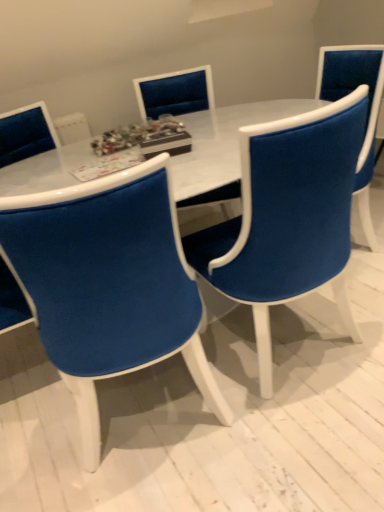
Describe the element at coordinates (108, 284) in the screenshot. I see `velvet blue chair at center, arranged as the first chair when viewed from the front` at that location.

At what (x,y) coordinates should I click in order to perform the action: click on velvet blue chair at center, the 1th chair in the back-to-front sequence. Please return your answer as a coordinate pair (x, y). Looking at the image, I should click on (175, 93).

Is velvet blue chair at center, arranged as the first chair when viewed from the front, at the right side of velvet blue chair at center, the 1th chair in the back-to-front sequence?

In fact, velvet blue chair at center, arranged as the first chair when viewed from the front, is to the left of velvet blue chair at center, the 1th chair in the back-to-front sequence.

Is velvet blue chair at center, the third chair positioned from the back, positioned beyond the bounds of velvet blue chair at center, the 1th chair in the back-to-front sequence?

Yes, velvet blue chair at center, the third chair positioned from the back, is outside of velvet blue chair at center, the 1th chair in the back-to-front sequence.

From the image's perspective, between velvet blue chair at center, arranged as the first chair when viewed from the front, and velvet blue chair at center, arranged as the third chair when viewed from the front, who is located below?

velvet blue chair at center, arranged as the first chair when viewed from the front, appears lower in the image.

How many degrees apart are the facing directions of velvet blue chair at center, the third chair positioned from the back, and velvet blue chair at center, the 1th chair in the back-to-front sequence?

There is a 165-degree angle between the facing directions of velvet blue chair at center, the third chair positioned from the back, and velvet blue chair at center, the 1th chair in the back-to-front sequence.

Considering the sizes of objects velvet blue chair at center, the third chair positioned from the back, and velvet blue chair at center, the 2th chair positioned from the front, in the image provided, who is wider, velvet blue chair at center, the third chair positioned from the back, or velvet blue chair at center, the 2th chair positioned from the front,?

velvet blue chair at center, the 2th chair positioned from the front, is wider.

Is velvet blue chair at center, the 2th chair positioned from the front, at the back of velvet blue chair at center, arranged as the first chair when viewed from the front?

No.

From a real-world perspective, between velvet blue chair at center, the third chair positioned from the back, and velvet blue chair at center, placed as the 2th chair when sorted from back to front, who is vertically higher?

velvet blue chair at center, the third chair positioned from the back, from a real-world perspective.

Does velvet blue chair at center, arranged as the first chair when viewed from the front, have a lesser height compared to velvet blue chair at center, placed as the 2th chair when sorted from back to front?

Correct, velvet blue chair at center, arranged as the first chair when viewed from the front, is not as tall as velvet blue chair at center, placed as the 2th chair when sorted from back to front.

From their relative heights in the image, would you say velvet blue chair at center, arranged as the third chair when viewed from the front, is taller or shorter than white marble table at center?

Clearly, velvet blue chair at center, arranged as the third chair when viewed from the front, is taller compared to white marble table at center.

In the image, is velvet blue chair at center, the 1th chair in the back-to-front sequence, positioned in front of or behind white marble table at center?

Clearly, velvet blue chair at center, the 1th chair in the back-to-front sequence, is behind white marble table at center.

Considering the points (193, 96) and (196, 126), which point is behind, point (193, 96) or point (196, 126)?

Positioned behind is point (193, 96).

Based on the photo, are velvet blue chair at center, the 1th chair in the back-to-front sequence, and white marble table at center beside each other?

No, velvet blue chair at center, the 1th chair in the back-to-front sequence, is not next to white marble table at center.

Which of these two, velvet blue chair at center, the third chair positioned from the back, or white marble table at center, is thinner?

velvet blue chair at center, the third chair positioned from the back, is thinner.

Between velvet blue chair at center, arranged as the first chair when viewed from the front, and white marble table at center, which one appears on the right side from the viewer's perspective?

white marble table at center is more to the right.

Is velvet blue chair at center, arranged as the first chair when viewed from the front, facing away from white marble table at center?

Yes, velvet blue chair at center, arranged as the first chair when viewed from the front,'s orientation is away from white marble table at center.

Locate an element on the screen. The image size is (384, 512). table on the right of velvet blue chair at center, arranged as the first chair when viewed from the front is located at coordinates (224, 143).

Does velvet blue chair at center, the 2th chair positioned from the front, come behind velvet blue chair at center, arranged as the first chair when viewed from the front?

Yes.

Is velvet blue chair at center, the 2th chair positioned from the front, facing towards velvet blue chair at center, the third chair positioned from the back?

No.

Is velvet blue chair at center, the 2th chair positioned from the front, inside or outside of velvet blue chair at center, arranged as the first chair when viewed from the front?

velvet blue chair at center, the 2th chair positioned from the front, lies outside velvet blue chair at center, arranged as the first chair when viewed from the front.

In the scene shown: Can you confirm if velvet blue chair at center, placed as the 2th chair when sorted from back to front, is wider than velvet blue chair at center, the third chair positioned from the back?

Yes.

Is point (38, 170) positioned after point (211, 95)?

That is False.

Is white marble table at center thinner than velvet blue chair at center, the 1th chair in the back-to-front sequence?

In fact, white marble table at center might be wider than velvet blue chair at center, the 1th chair in the back-to-front sequence.

Looking at this image, does white marble table at center turn towards velvet blue chair at center, arranged as the third chair when viewed from the front?

Yes, white marble table at center is aimed at velvet blue chair at center, arranged as the third chair when viewed from the front.

In terms of height, does white marble table at center look taller or shorter compared to velvet blue chair at center, arranged as the third chair when viewed from the front?

Clearly, white marble table at center is shorter compared to velvet blue chair at center, arranged as the third chair when viewed from the front.

Is white marble table at center situated inside velvet blue chair at center, the third chair positioned from the back, or outside?

white marble table at center is outside velvet blue chair at center, the third chair positioned from the back.

From a real-world perspective, which object stands above the other?

From a 3D spatial view, velvet blue chair at center, arranged as the first chair when viewed from the front, is above.

Is point (194, 195) positioned behind point (152, 358)?

Yes, point (194, 195) is farther from viewer.

From the image's perspective, is white marble table at center beneath velvet blue chair at center, the third chair positioned from the back?

Actually, white marble table at center appears above velvet blue chair at center, the third chair positioned from the back, in the image.

Locate an element on the screen. the 2nd chair below the velvet blue chair at center, arranged as the third chair when viewed from the front (from the image's perspective) is located at coordinates (108, 284).

Identify the location of the 1st chair above the velvet blue chair at center, the third chair positioned from the back (from the image's perspective). This screenshot has height=512, width=384. (288, 217).

Looking at this image, looking at the image, which one is located closer to velvet blue chair at center, the 2th chair positioned from the front, velvet blue chair at center, the 1th chair in the back-to-front sequence, or velvet blue chair at center, arranged as the first chair when viewed from the front?

velvet blue chair at center, arranged as the first chair when viewed from the front, lies closer to velvet blue chair at center, the 2th chair positioned from the front, than the other object.

Considering their positions, is white marble table at center positioned further to velvet blue chair at center, placed as the 2th chair when sorted from back to front, than velvet blue chair at center, arranged as the third chair when viewed from the front?

velvet blue chair at center, arranged as the third chair when viewed from the front, lies further to velvet blue chair at center, placed as the 2th chair when sorted from back to front, than the other object.

Estimate the real-world distances between objects in this image. Which object is further from velvet blue chair at center, the 2th chair positioned from the front, velvet blue chair at center, the 1th chair in the back-to-front sequence, or white marble table at center?

The object further to velvet blue chair at center, the 2th chair positioned from the front, is velvet blue chair at center, the 1th chair in the back-to-front sequence.

Estimate the real-world distances between objects in this image. Which object is further from velvet blue chair at center, the 2th chair positioned from the front, velvet blue chair at center, arranged as the first chair when viewed from the front, or velvet blue chair at center, the 1th chair in the back-to-front sequence?

velvet blue chair at center, the 1th chair in the back-to-front sequence.

Considering their positions, is velvet blue chair at center, arranged as the first chair when viewed from the front, positioned closer to white marble table at center than velvet blue chair at center, placed as the 2th chair when sorted from back to front?

velvet blue chair at center, placed as the 2th chair when sorted from back to front, lies closer to white marble table at center than the other object.

When comparing their distances from velvet blue chair at center, arranged as the third chair when viewed from the front, does velvet blue chair at center, arranged as the first chair when viewed from the front, or velvet blue chair at center, placed as the 2th chair when sorted from back to front, seem closer?

velvet blue chair at center, placed as the 2th chair when sorted from back to front, is positioned closer to the anchor velvet blue chair at center, arranged as the third chair when viewed from the front.

Looking at the image, which one is located closer to velvet blue chair at center, arranged as the first chair when viewed from the front, velvet blue chair at center, arranged as the third chair when viewed from the front, or white marble table at center?

The object closer to velvet blue chair at center, arranged as the first chair when viewed from the front, is white marble table at center.

Based on the photo, considering their positions, is velvet blue chair at center, the 1th chair in the back-to-front sequence, positioned closer to velvet blue chair at center, the third chair positioned from the back, than velvet blue chair at center, the 2th chair positioned from the front?

velvet blue chair at center, the 2th chair positioned from the front, is positioned closer to the anchor velvet blue chair at center, the third chair positioned from the back.

The height and width of the screenshot is (512, 384). I want to click on table between velvet blue chair at center, the third chair positioned from the back, and velvet blue chair at center, the 2th chair positioned from the front, in the horizontal direction, so click(x=224, y=143).

Locate an element on the screen. Image resolution: width=384 pixels, height=512 pixels. table between velvet blue chair at center, arranged as the first chair when viewed from the front, and velvet blue chair at center, arranged as the third chair when viewed from the front, along the z-axis is located at coordinates click(224, 143).

Identify the location of table between velvet blue chair at center, the 2th chair positioned from the front, and velvet blue chair at center, arranged as the third chair when viewed from the front, in the front-back direction. (224, 143).

The image size is (384, 512). I want to click on chair positioned between velvet blue chair at center, arranged as the first chair when viewed from the front, and velvet blue chair at center, the 1th chair in the back-to-front sequence, from near to far, so click(288, 217).